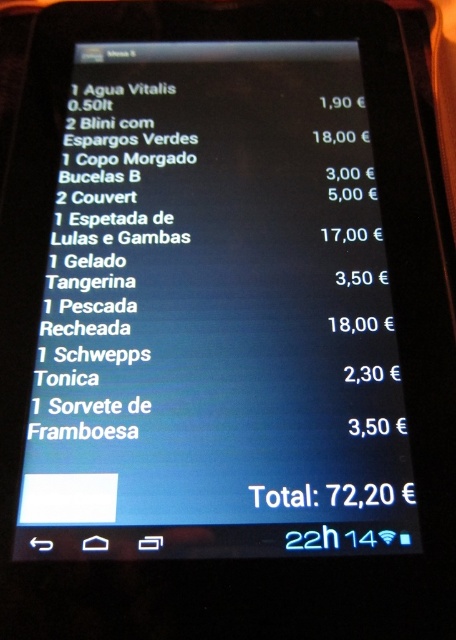
Can you confirm if black glossy tablet at center is positioned to the right of white paper menu at center?

Correct, you'll find black glossy tablet at center to the right of white paper menu at center.

Who is more distant from viewer, (119, 125) or (169, 138)?

The point (119, 125) is more distant.

Identify the location of black glossy tablet at center. This screenshot has width=456, height=640. (216, 314).